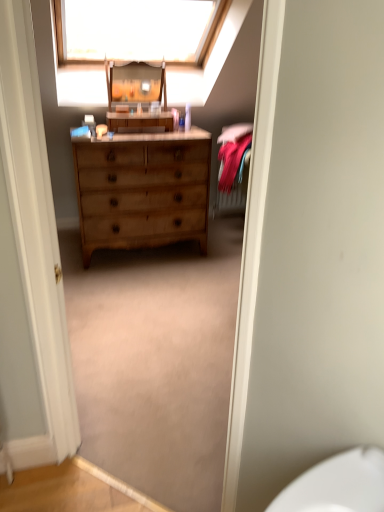
At what (x,y) coordinates should I click in order to perform the action: click on vacant region under velvet pink bed at right (from a real-world perspective). Please return your answer as a coordinate pair (x, y). Looking at the image, I should click on (233, 237).